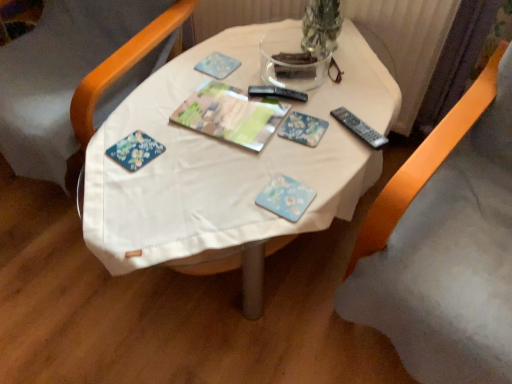
Where is `vacant space situated on the left part of floral paper magazine at center`? The height and width of the screenshot is (384, 512). vacant space situated on the left part of floral paper magazine at center is located at coordinates (155, 120).